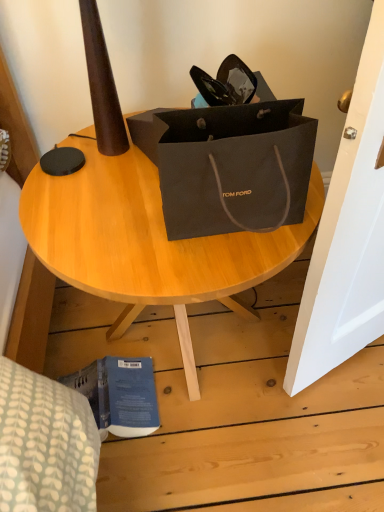
The image size is (384, 512). What do you see at coordinates (147, 243) in the screenshot?
I see `matte black bag at upper center` at bounding box center [147, 243].

You are a GUI agent. You are given a task and a screenshot of the screen. Output one action in this format:
    pyautogui.click(x=<x>, y=<y>)
    Task: Click on the matte black bag at upper center
    This screenshot has height=512, width=384.
    Given the screenshot: What is the action you would take?
    pyautogui.click(x=147, y=243)

Find the location of a particular element. blue matte book at lower left is located at coordinates (119, 394).

Describe the element at coordinates (119, 394) in the screenshot. I see `blue matte book at lower left` at that location.

In order to face blue matte book at lower left, should I rotate leftwards or rightwards?

You should look left and rotate roughly 11.342 degrees.

Find the location of a particular element. Image resolution: width=384 pixels, height=512 pixels. matte black bag at upper center is located at coordinates (147, 243).

Between blue matte book at lower left and matte black bag at upper center, which one appears on the left side from the viewer's perspective?

blue matte book at lower left.

In the image, is blue matte book at lower left positioned in front of or behind matte black bag at upper center?

In the image, blue matte book at lower left appears behind matte black bag at upper center.

Is point (122, 386) positioned before point (241, 238)?

No, (122, 386) is behind (241, 238).

From the image's perspective, which is below, blue matte book at lower left or matte black bag at upper center?

From the image's view, blue matte book at lower left is below.

From a real-world perspective, is blue matte book at lower left on matte black bag at upper center?

No, from a real-world perspective, blue matte book at lower left is not over matte black bag at upper center

Can you confirm if blue matte book at lower left is wider than matte black bag at upper center?

No.

Based on the photo, which of these two, blue matte book at lower left or matte black bag at upper center, stands taller?

matte black bag at upper center.

Between blue matte book at lower left and matte black bag at upper center, which one has smaller size?

With smaller size is blue matte book at lower left.

Can we say blue matte book at lower left lies outside matte black bag at upper center?

No, blue matte book at lower left is inside or overlapping with matte black bag at upper center.

Would you say blue matte book at lower left is a long distance from matte black bag at upper center?

No, there isn't a large distance between blue matte book at lower left and matte black bag at upper center.

Is blue matte book at lower left facing towards matte black bag at upper center?

Yes, blue matte book at lower left is turned towards matte black bag at upper center.

How many degrees apart are the facing directions of blue matte book at lower left and matte black bag at upper center?

The facing directions of blue matte book at lower left and matte black bag at upper center are 6.82 degrees apart.

The width and height of the screenshot is (384, 512). What are the coordinates of `coffee table in front of the blue matte book at lower left` in the screenshot? It's located at (147, 243).

From the picture: Can you confirm if matte black bag at upper center is positioned to the right of blue matte book at lower left?

Indeed, matte black bag at upper center is positioned on the right side of blue matte book at lower left.

Is matte black bag at upper center further to the viewer compared to blue matte book at lower left?

No, matte black bag at upper center is closer to the viewer.

Is point (187, 249) closer or farther from the camera than point (147, 413)?

Clearly, point (187, 249) is closer to the camera than point (147, 413).

From the image's perspective, is matte black bag at upper center beneath blue matte book at lower left?

Incorrect, from the image's perspective, matte black bag at upper center is higher than blue matte book at lower left.

From a real-world perspective, which is physically below, matte black bag at upper center or blue matte book at lower left?

In real-world perspective, blue matte book at lower left is lower.

In the scene shown: Considering the sizes of objects matte black bag at upper center and blue matte book at lower left in the image provided, who is thinner, matte black bag at upper center or blue matte book at lower left?

Thinner between the two is blue matte book at lower left.

Considering the sizes of objects matte black bag at upper center and blue matte book at lower left in the image provided, who is taller, matte black bag at upper center or blue matte book at lower left?

matte black bag at upper center is taller.

Who is bigger, matte black bag at upper center or blue matte book at lower left?

matte black bag at upper center is bigger.

Would you say blue matte book at lower left is part of matte black bag at upper center's contents?

That's correct, blue matte book at lower left is inside matte black bag at upper center.

Is matte black bag at upper center next to blue matte book at lower left?

No, matte black bag at upper center is not with blue matte book at lower left.

Is matte black bag at upper center aimed at blue matte book at lower left?

Yes, matte black bag at upper center is turned towards blue matte book at lower left.

How different are the orientations of matte black bag at upper center and blue matte book at lower left in degrees?

They differ by 6.82 degrees in their facing directions.

The image size is (384, 512). I want to click on book behind the matte black bag at upper center, so click(119, 394).

Where is `coffee table on the right side of blue matte book at lower left`? coffee table on the right side of blue matte book at lower left is located at coordinates (147, 243).

The image size is (384, 512). What are the coordinates of `coffee table above the blue matte book at lower left (from the image's perspective)` in the screenshot? It's located at click(147, 243).